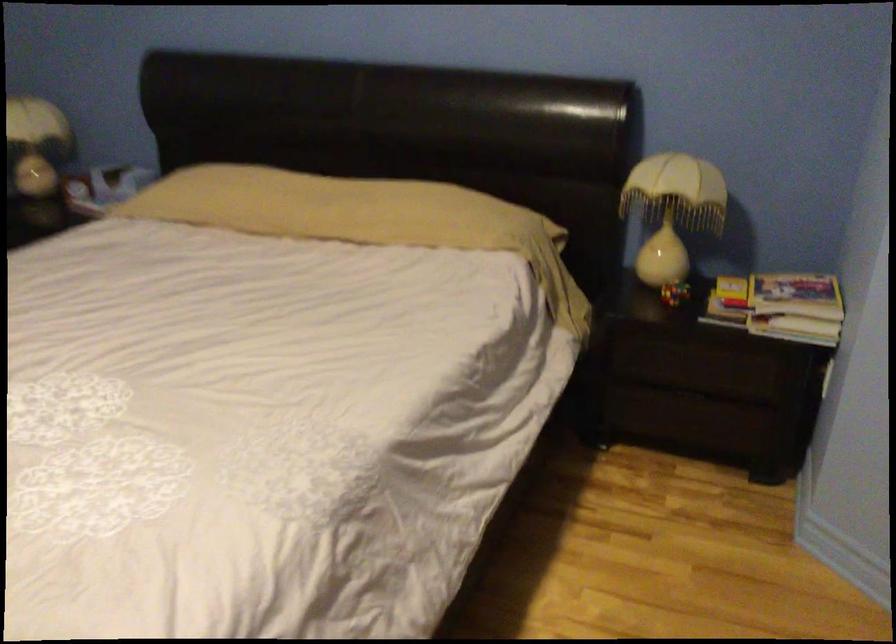
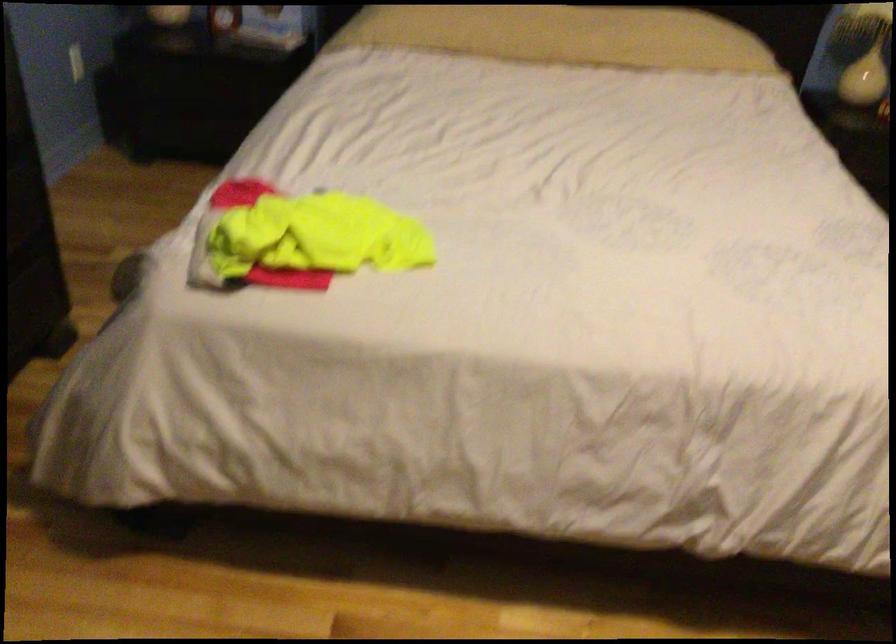
Question: Which direction would the cameraman need to move to produce the second image? Reply with the corresponding letter.

Choices:
 (A) Left
 (B) Right
 (C) Forward
 (D) Backward

Answer: (A)